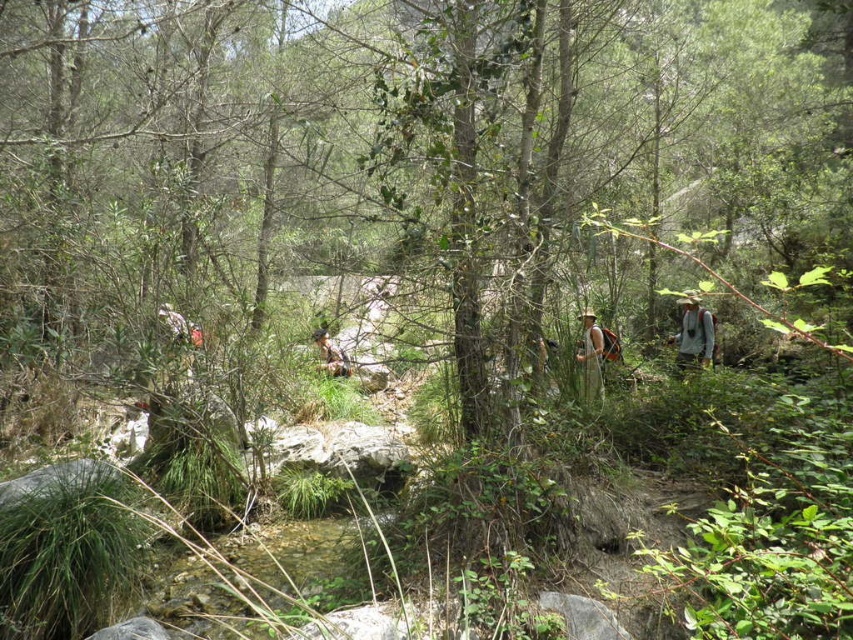
Question: Which of the following is the closest to the observer?

Choices:
 (A) (346, 365)
 (B) (682, 324)
 (C) (593, 321)

Answer: (C)

Question: Which point appears farthest from the camera in this image?

Choices:
 (A) (585, 360)
 (B) (332, 374)
 (C) (685, 310)

Answer: (B)

Question: Is white fabric dress at center positioned in front of brown leather backpack at center?

Choices:
 (A) no
 (B) yes

Answer: (B)

Question: Which object is closer to the camera taking this photo?

Choices:
 (A) camouflage fabric shirt at right
 (B) white fabric dress at center

Answer: (B)

Question: Observing the image, what is the correct spatial positioning of camouflage fabric shirt at right in reference to brown leather backpack at center?

Choices:
 (A) right
 (B) left

Answer: (A)

Question: Is camouflage fabric shirt at right to the right of white fabric dress at center from the viewer's perspective?

Choices:
 (A) no
 (B) yes

Answer: (B)